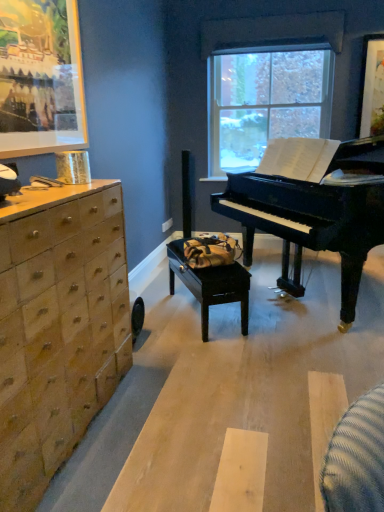
Locate an element on the screen. vacant region to the right of black wood table at center is located at coordinates (302, 327).